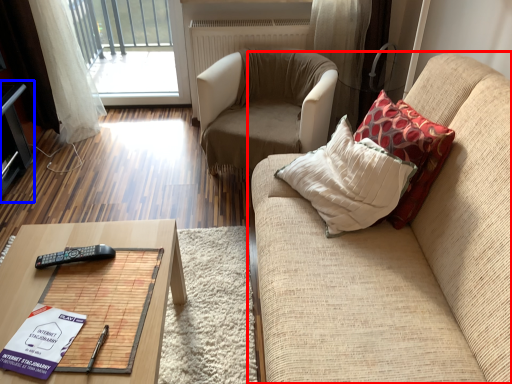
Question: Which object appears closest to the camera in this image, studio couch (highlighted by a red box) or entertainment center (highlighted by a blue box)?

Choices:
 (A) studio couch
 (B) entertainment center

Answer: (A)